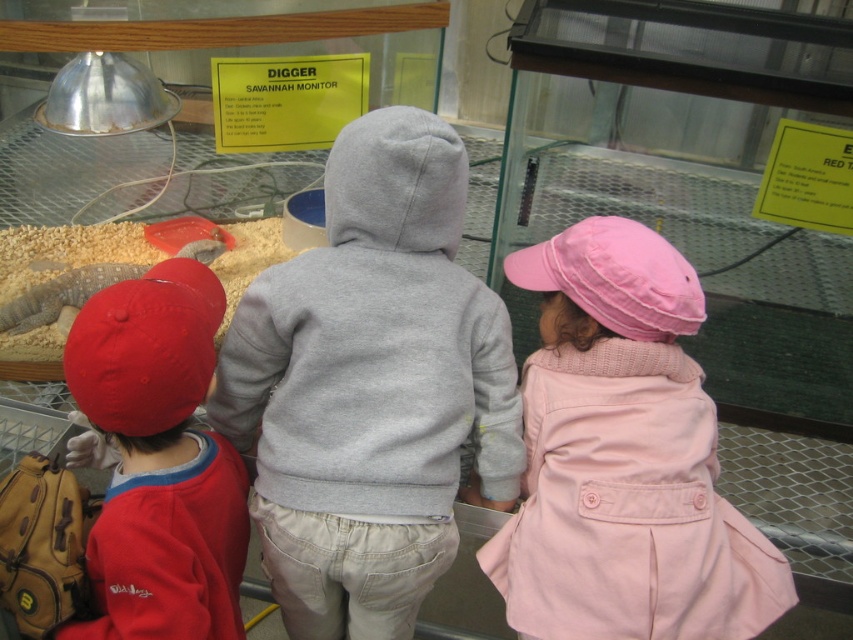
Looking at this image, between gray fleece hoodie at center and matte red cap at left, which one is positioned higher?

gray fleece hoodie at center is higher up.

Is point (335, 246) less distant than point (171, 332)?

That is False.

This screenshot has width=853, height=640. What are the coordinates of `gray fleece hoodie at center` in the screenshot? It's located at (370, 387).

Measure the distance from pink cotton coat at center to matte red cap at left.

19.02 inches

Does pink cotton coat at center have a greater height compared to matte red cap at left?

Correct, pink cotton coat at center is much taller as matte red cap at left.

Where is `pink cotton coat at center`? This screenshot has height=640, width=853. pink cotton coat at center is located at coordinates (x=624, y=458).

Does gray fleece hoodie at center have a smaller size compared to pink cotton coat at center?

No.

Does gray fleece hoodie at center have a lesser height compared to pink cotton coat at center?

In fact, gray fleece hoodie at center may be taller than pink cotton coat at center.

Between point (225, 396) and point (662, 332), which one is positioned in front?

Point (662, 332) is in front.

Where is `gray fleece hoodie at center`? This screenshot has height=640, width=853. gray fleece hoodie at center is located at coordinates (370, 387).